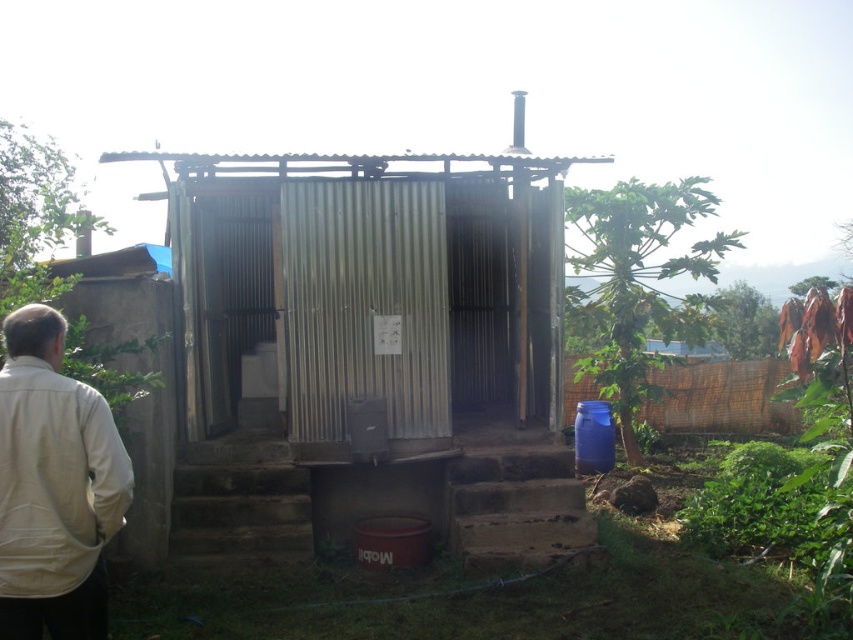
Can you confirm if corrugated metal hut at center is shorter than beige fabric jacket at lower left?

No, corrugated metal hut at center is not shorter than beige fabric jacket at lower left.

In the scene shown: Between corrugated metal hut at center and beige fabric jacket at lower left, which one has less height?

beige fabric jacket at lower left is shorter.

I want to click on corrugated metal hut at center, so click(x=372, y=348).